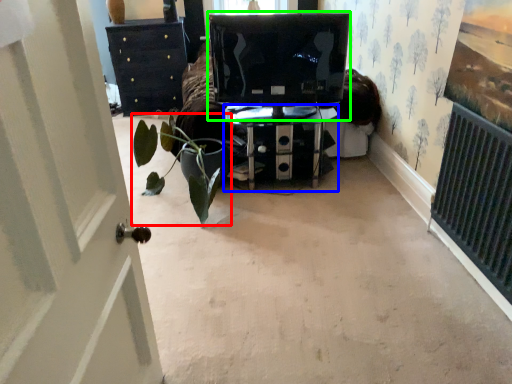
Question: Based on their relative distances, which object is farther from houseplant (highlighted by a red box)? Choose from furniture (highlighted by a blue box) and computer monitor (highlighted by a green box).

Choices:
 (A) furniture
 (B) computer monitor

Answer: (B)